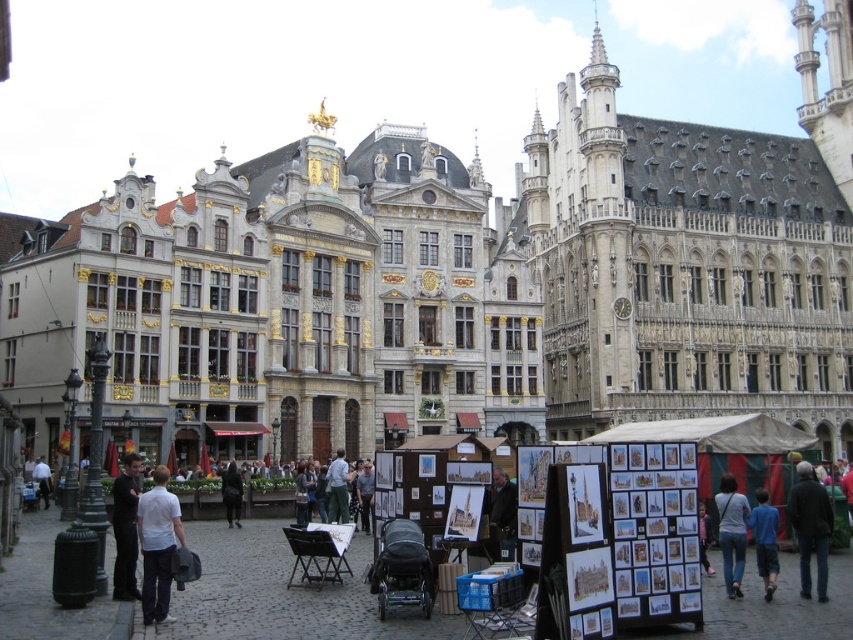
Question: Which object is positioned closest to the dark brown leather jacket at lower right?

Choices:
 (A) dark gray coat at center
 (B) white shirt at lower left
 (C) white stone building at center
 (D) light blue fabric at center

Answer: (D)

Question: Can you confirm if white stone building at center is bigger than dark brown leather jacket at lower right?

Choices:
 (A) no
 (B) yes

Answer: (B)

Question: Does dark brown leather jacket at lower right have a smaller size compared to dark gray jacket at center?

Choices:
 (A) yes
 (B) no

Answer: (A)

Question: Which of the following is the farthest from the observer?

Choices:
 (A) (41, 476)
 (B) (160, 582)

Answer: (A)

Question: Where is blue cotton shirt at lower right located in relation to dark gray coat at center in the image?

Choices:
 (A) right
 (B) left

Answer: (A)

Question: Which object is closer to the camera taking this photo?

Choices:
 (A) light blue fabric at center
 (B) dark gray jacket at center

Answer: (B)